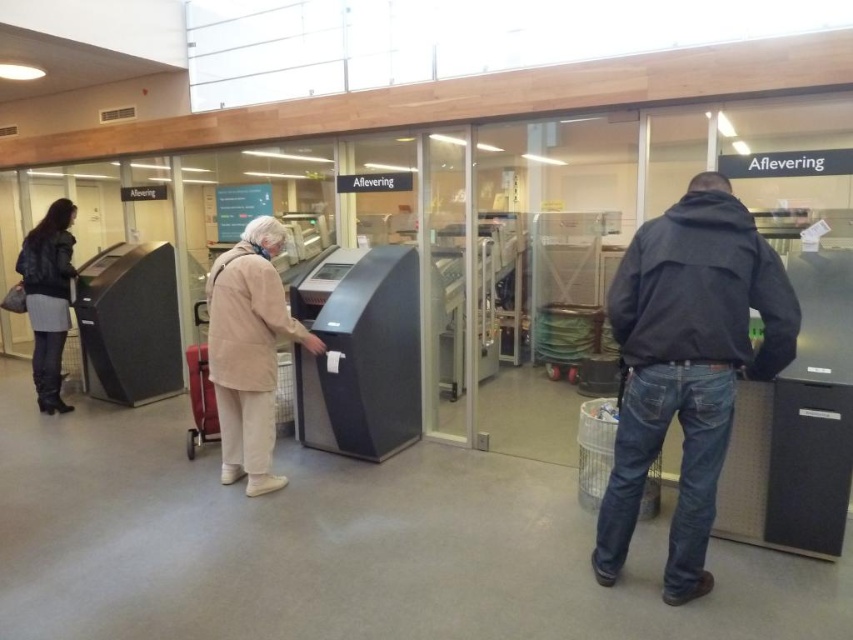
Does beige fabric coat at center have a larger size compared to matte black jacket at left?

Yes.

Can you confirm if beige fabric coat at center is smaller than matte black jacket at left?

Actually, beige fabric coat at center might be larger than matte black jacket at left.

This screenshot has width=853, height=640. I want to click on beige fabric coat at center, so click(x=248, y=352).

Locate an element on the screen. The width and height of the screenshot is (853, 640). beige fabric coat at center is located at coordinates (248, 352).

Which is below, dark blue jacket at right or beige fabric coat at center?

dark blue jacket at right is below.

Who is more distant from viewer, (598, 531) or (263, 241)?

The point (263, 241) is behind.

Where is `dark blue jacket at right`? The image size is (853, 640). dark blue jacket at right is located at coordinates (688, 364).

Between dark blue jacket at right and matte black jacket at left, which one is positioned lower?

Positioned lower is dark blue jacket at right.

Can you confirm if dark blue jacket at right is wider than matte black jacket at left?

Yes, dark blue jacket at right is wider than matte black jacket at left.

Describe the element at coordinates (688, 364) in the screenshot. I see `dark blue jacket at right` at that location.

Where is `dark blue jacket at right`? dark blue jacket at right is located at coordinates (688, 364).